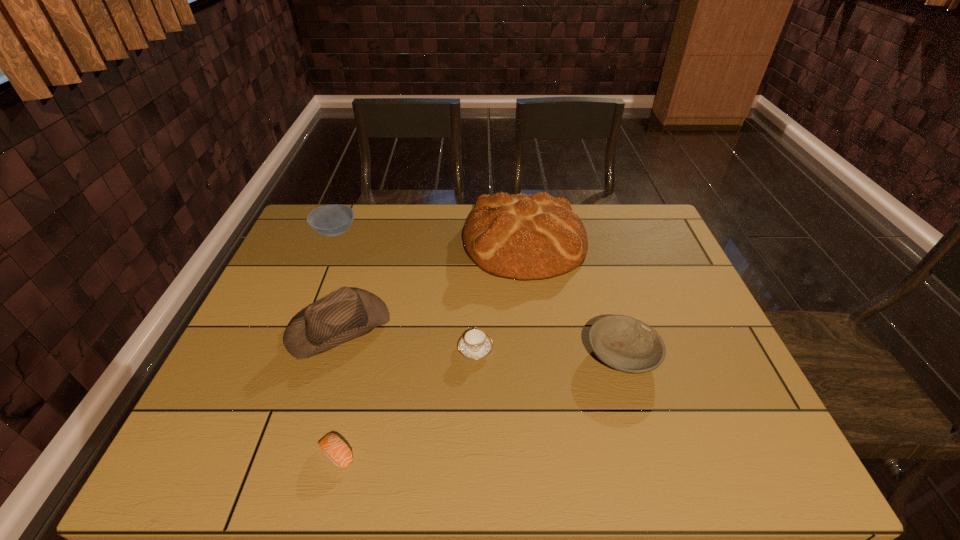
Locate an element on the screen. This screenshot has width=960, height=540. vacant space located on the right of the second tallest object is located at coordinates pos(529,326).

What are the coordinates of `free region located 0.060m on the front of the taller bowl` in the screenshot? It's located at (324, 258).

Locate an element on the screen. vacant area situated on the right of the shorter bowl is located at coordinates (691, 355).

I want to click on vacant space situated 0.380m on the side with the handle of the teacup, so click(x=476, y=244).

I want to click on free space located on the side with the handle of the teacup, so click(x=476, y=271).

I want to click on free space located on the side with the handle of the teacup, so click(476, 278).

The height and width of the screenshot is (540, 960). In order to click on free space located 0.080m on the left of the nearest object in this screenshot , I will do `click(276, 455)`.

Locate an element on the screen. This screenshot has width=960, height=540. bread present at the far edge is located at coordinates (523, 237).

Identify the location of bowl present at the far edge. The height and width of the screenshot is (540, 960). (331, 220).

In order to click on object at the near edge in this screenshot , I will do coord(335,449).